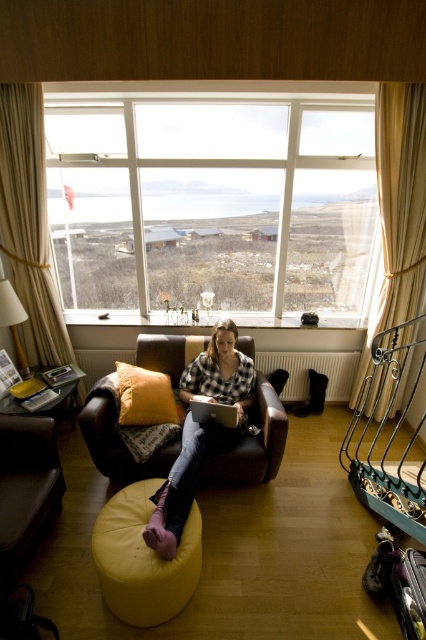
From the picture: You are a delivery person who needs to place a small package between the yellow fabric ottoman at lower center and the silver metallic laptop at center. Is there enough space between them for the package?

The yellow fabric ottoman at lower center is positioned on the left side of the silver metallic laptop at center, so there is space between them to place the small package.

You are sitting in the brown leather armchair and want to reach both the velvet orange pillow at center and the silver metallic laptop at center. Which object will you need to reach further to get?

The silver metallic laptop at center is further away from you than the velvet orange pillow at center, so you will need to reach further to get the silver metallic laptop at center.

Where is the velvet orange pillow at center located in the image?

The velvet orange pillow at center is located at point [144,396] in the image.